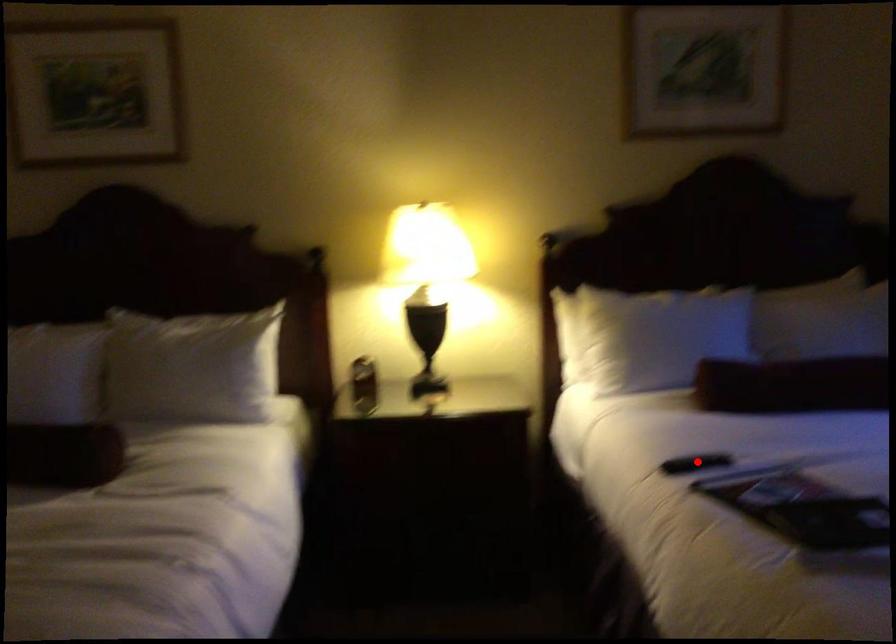
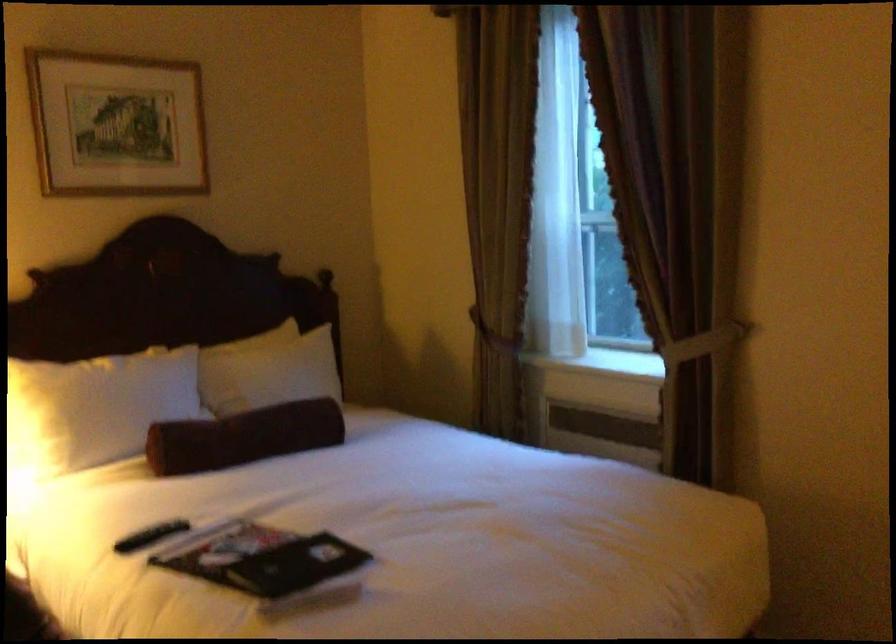
The point at the highlighted location is marked in the first image. Where is the corresponding point in the second image?

(151, 536)